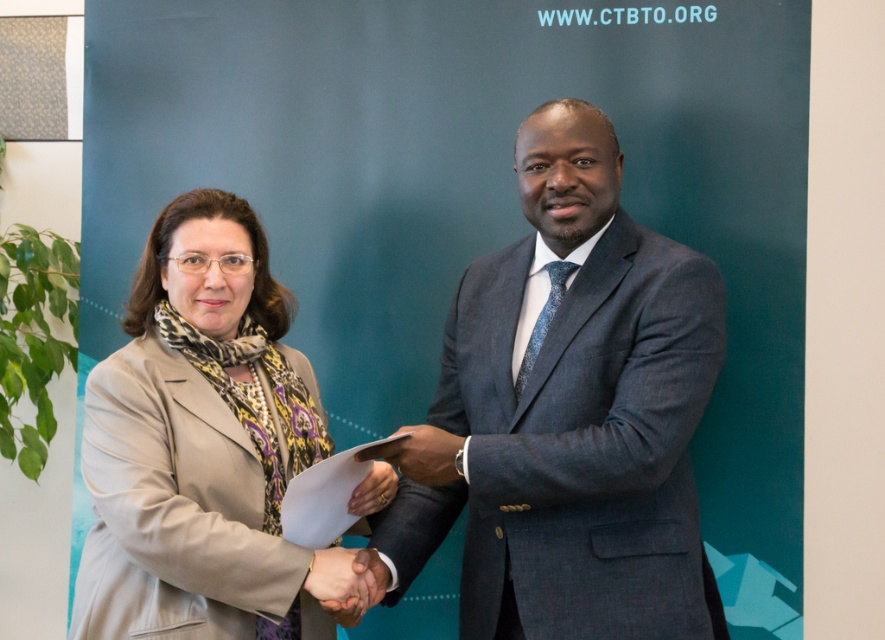
You are a photographer at the event and need to ensure that both the dark gray suit at center and the matte black hand at center are clearly visible in your photo. Considering their sizes, which one might require more careful framing to avoid being too small in the image?

The matte black hand at center is smaller in size than the dark gray suit at center, so it might require more careful framing to ensure it is not too small in the photo.